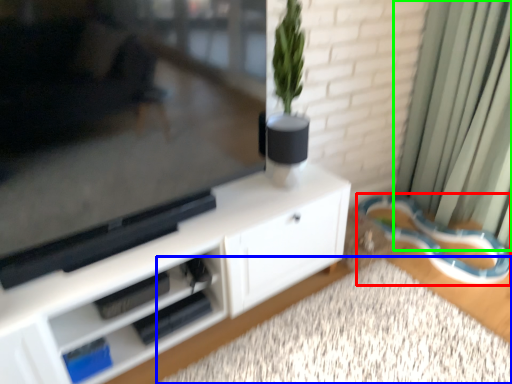
Question: Considering the real-world distances, which object is farthest from leash (highlighted by a red box)? plain (highlighted by a blue box) or curtain (highlighted by a green box)?

Choices:
 (A) plain
 (B) curtain

Answer: (A)